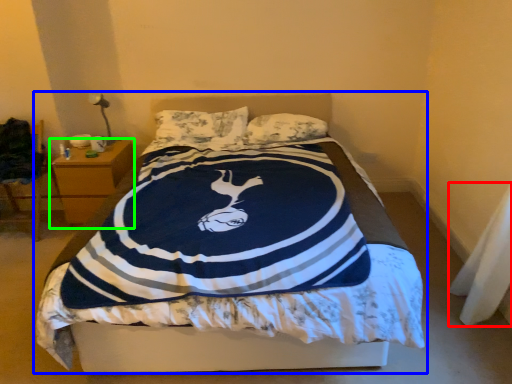
Question: Which object is positioned closest to material (highlighted by a red box)? Select from bed (highlighted by a blue box) and nightstand (highlighted by a green box).

Choices:
 (A) bed
 (B) nightstand

Answer: (A)